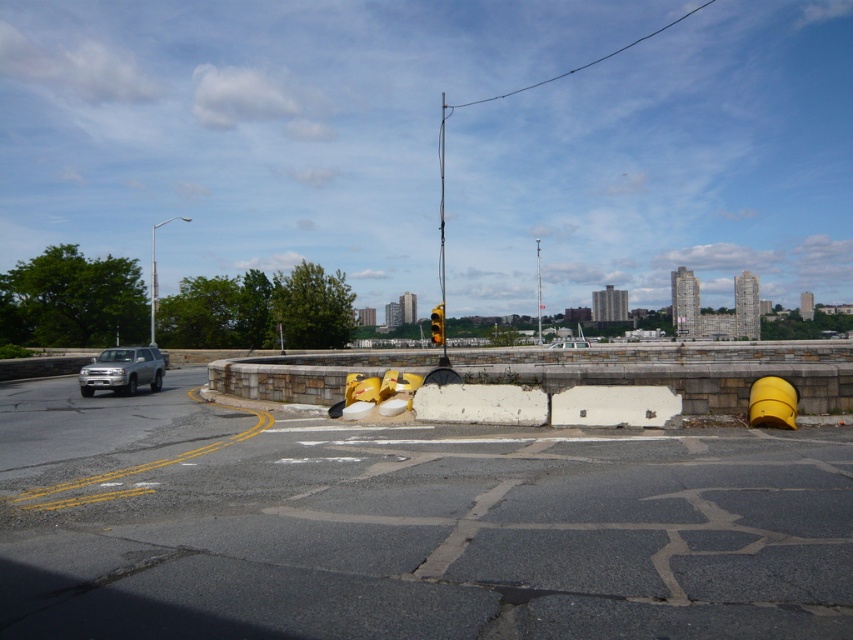
Question: Which of these objects is positioned closest to the yellow rubber barrier at center?

Choices:
 (A) metallic pole at center
 (B) asphalt at center
 (C) metallic traffic light at center
 (D) silver metallic suv at left

Answer: (B)

Question: Which point is farther from the camera taking this photo?

Choices:
 (A) (845, 396)
 (B) (439, 148)
 (C) (537, 326)
 (D) (96, 380)

Answer: (B)

Question: Can you confirm if silver metallic suv at left is smaller than metallic traffic light at center?

Choices:
 (A) no
 (B) yes

Answer: (B)

Question: Is the position of silver metallic suv at left less distant than that of metallic traffic light at center?

Choices:
 (A) yes
 (B) no

Answer: (A)

Question: Can you confirm if asphalt at center is positioned to the right of metallic traffic light at center?

Choices:
 (A) no
 (B) yes

Answer: (A)

Question: Which point appears closest to the camera in this image?

Choices:
 (A) (177, 540)
 (B) (491, 355)
 (C) (540, 288)
 (D) (440, 147)

Answer: (A)